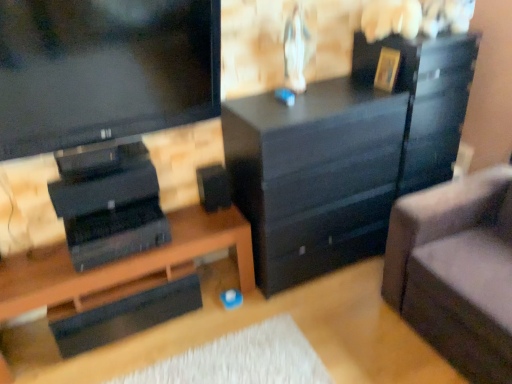
Where is `vacant space underneath black matte desk at lower left (from a real-world perspective)`? vacant space underneath black matte desk at lower left (from a real-world perspective) is located at coordinates (130, 324).